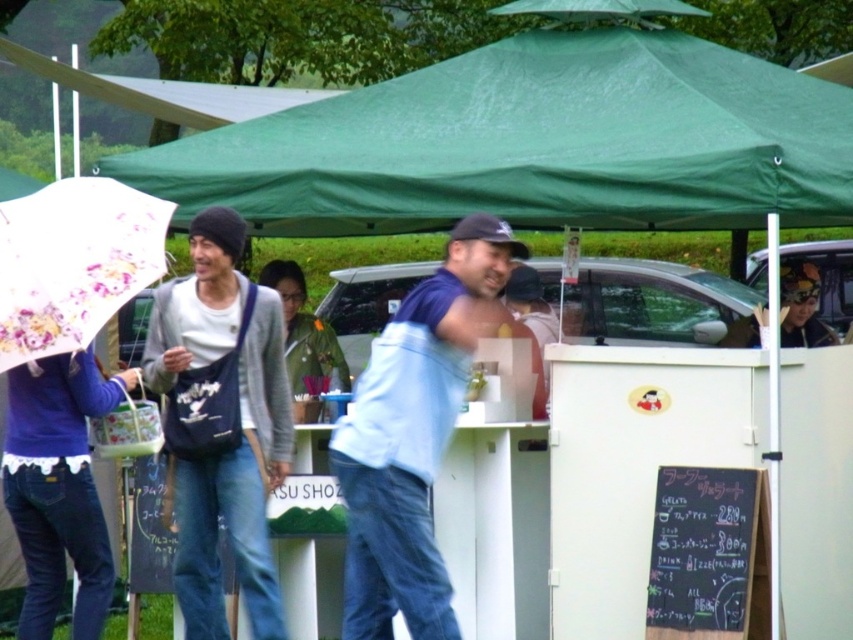
You are standing in the market scene under the green canopy tent. There are two points marked in the image. The first point is at coordinate point (x=224, y=621) and the second is at point (x=469, y=236). Which of these two points is closer to your current position?

Point (x=224, y=621) is further to the camera than point (x=469, y=236). Therefore, the point closer to your current position is point (x=469, y=236).